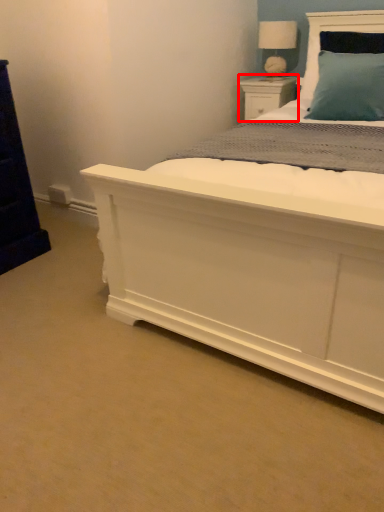
Question: Considering the relative positions of nightstand (annotated by the red box) and table lamp in the image provided, where is nightstand (annotated by the red box) located with respect to the staircase?

Choices:
 (A) left
 (B) right

Answer: (A)